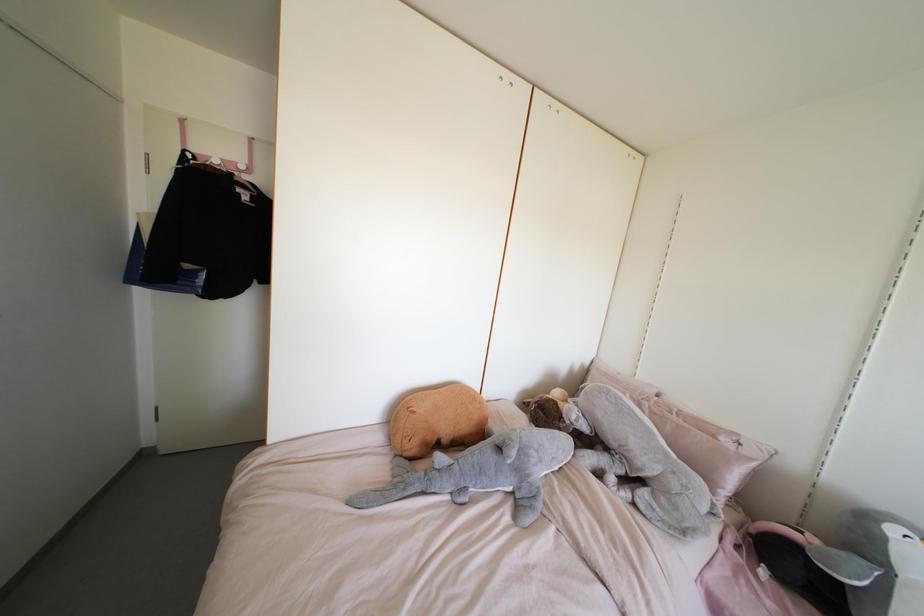
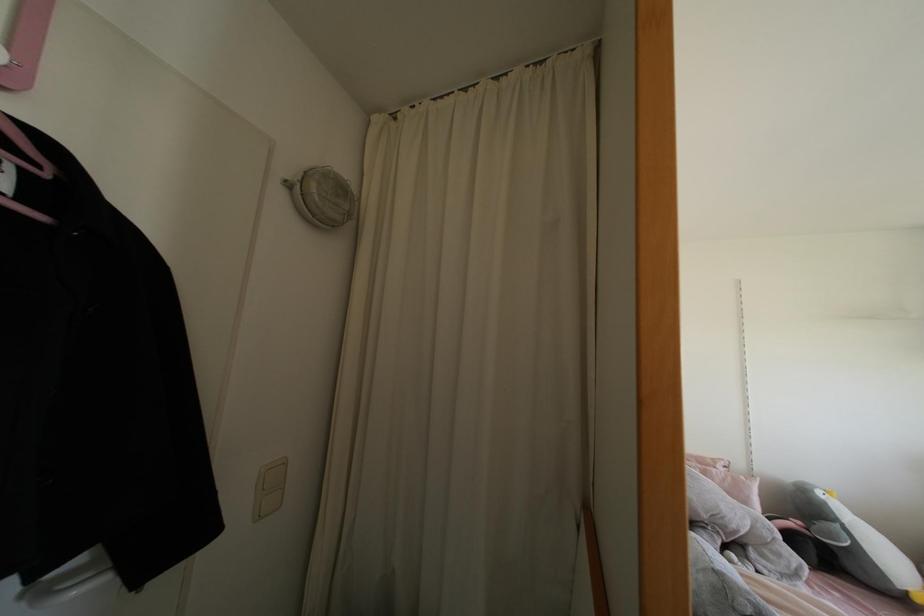
The point at (892, 530) is marked in the first image. Where is the corresponding point in the second image?

(819, 493)